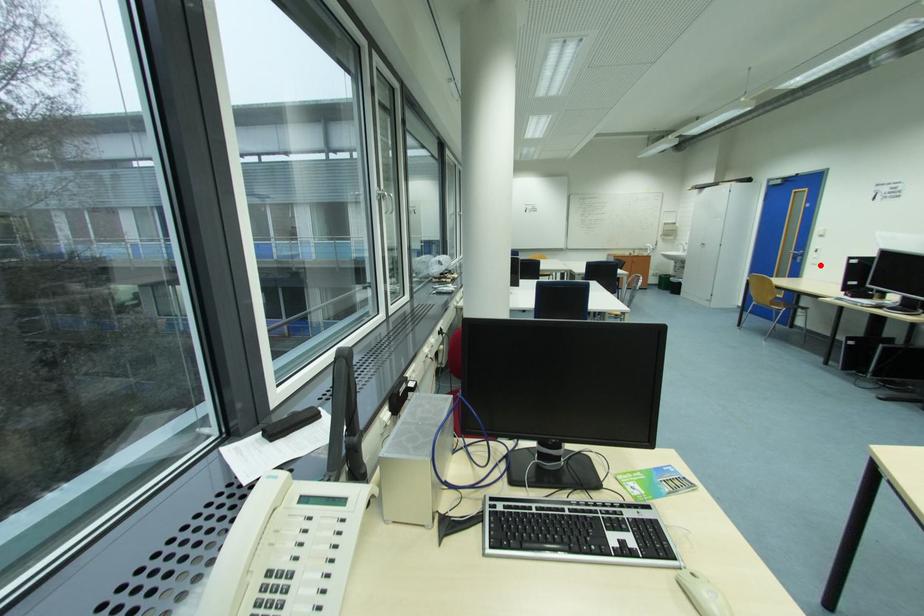
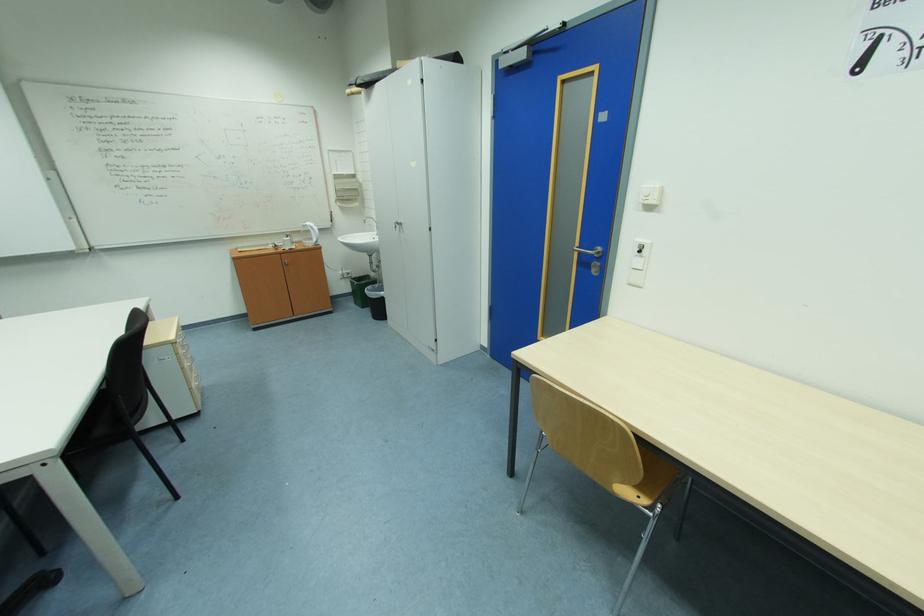
Question: I am providing you with two images of the same scene from different viewpoints. Image1 has a red point marked. In image2, the corresponding 3D location appears at what relative position? Reply with the corresponding letter.

Choices:
 (A) Closer
 (B) Farther

Answer: (A)